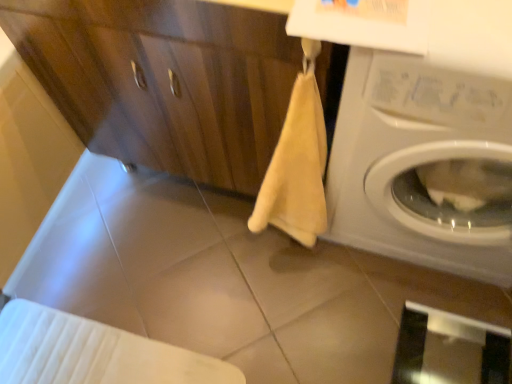
This screenshot has width=512, height=384. What do you see at coordinates (164, 80) in the screenshot?
I see `matte wood dresser at center` at bounding box center [164, 80].

Find the location of `beige matte tile at center`. beige matte tile at center is located at coordinates 202,304.

Where is `transparent glass screen door at lower right`? transparent glass screen door at lower right is located at coordinates (450, 349).

What is the approximate width of white glossy washing machine at right?

white glossy washing machine at right is 40.90 centimeters wide.

Locate an element on the screen. Image resolution: width=512 pixels, height=384 pixels. matte wood dresser at center is located at coordinates (164, 80).

Considering the sizes of objects matte wood dresser at center and beige matte tile at center in the image provided, who is thinner, matte wood dresser at center or beige matte tile at center?

Thinner between the two is beige matte tile at center.

Locate an element on the screen. The height and width of the screenshot is (384, 512). dresser positioned vertically above the beige matte tile at center (from a real-world perspective) is located at coordinates (164, 80).

Can you confirm if matte wood dresser at center is bigger than beige matte tile at center?

Yes, matte wood dresser at center is bigger than beige matte tile at center.

Is the surface of matte wood dresser at center in direct contact with beige matte tile at center?

No, matte wood dresser at center is not next to beige matte tile at center.

Based on the photo, is beige matte tile at center at the right side of matte wood dresser at center?

In fact, beige matte tile at center is to the left of matte wood dresser at center.

In the image, is beige matte tile at center positioned in front of or behind matte wood dresser at center?

In the image, beige matte tile at center appears behind matte wood dresser at center.

Is beige matte tile at center not close to matte wood dresser at center?

That's not correct — beige matte tile at center is a little close to matte wood dresser at center.

From the image's perspective, relative to matte wood dresser at center, is beige matte tile at center above or below?

beige matte tile at center is situated lower than matte wood dresser at center in the image.

Consider the image. Which object is positioned more to the right, white glossy washing machine at right or transparent glass screen door at lower right?

Positioned to the right is transparent glass screen door at lower right.

From a real-world perspective, between white glossy washing machine at right and transparent glass screen door at lower right, who is vertically lower?

transparent glass screen door at lower right is physically lower.

Based on the photo, are white glossy washing machine at right and transparent glass screen door at lower right far apart?

white glossy washing machine at right is actually quite close to transparent glass screen door at lower right.

Is transparent glass screen door at lower right situated inside matte wood dresser at center or outside?

transparent glass screen door at lower right is not enclosed by matte wood dresser at center.

Can you confirm if transparent glass screen door at lower right is taller than matte wood dresser at center?

Incorrect, the height of transparent glass screen door at lower right is not larger of that of matte wood dresser at center.

From the image's perspective, is transparent glass screen door at lower right on top of matte wood dresser at center?

No, from the image's perspective, transparent glass screen door at lower right is not over matte wood dresser at center.

How far apart are transparent glass screen door at lower right and matte wood dresser at center?

A distance of 86.95 centimeters exists between transparent glass screen door at lower right and matte wood dresser at center.

Is matte wood dresser at center shorter than transparent glass screen door at lower right?

Incorrect, the height of matte wood dresser at center does not fall short of that of transparent glass screen door at lower right.

What's the angular difference between matte wood dresser at center and transparent glass screen door at lower right's facing directions?

0.22 degrees separate the facing orientations of matte wood dresser at center and transparent glass screen door at lower right.

Are matte wood dresser at center and transparent glass screen door at lower right making contact?

No, matte wood dresser at center is not touching transparent glass screen door at lower right.

Does matte wood dresser at center have a larger size compared to transparent glass screen door at lower right?

Yes, matte wood dresser at center is bigger than transparent glass screen door at lower right.

Is transparent glass screen door at lower right far away from beige matte tile at center?

transparent glass screen door at lower right is actually quite close to beige matte tile at center.

At what (x,y) coordinates should I click in order to perform the action: click on screen door on the right of beige matte tile at center. Please return your answer as a coordinate pair (x, y). Looking at the image, I should click on (450, 349).

From the image's perspective, is transparent glass screen door at lower right positioned above or below beige matte tile at center?

Based on their image positions, transparent glass screen door at lower right is located beneath beige matte tile at center.

From a real-world perspective, which object rests below the other?

transparent glass screen door at lower right.

Considering the positions of objects matte wood dresser at center and white glossy washing machine at right in the image provided, who is behind, matte wood dresser at center or white glossy washing machine at right?

matte wood dresser at center is further from the camera.

From the image's perspective, is matte wood dresser at center over white glossy washing machine at right?

Yes, from the image's perspective, matte wood dresser at center is on top of white glossy washing machine at right.

Which object is positioned more to the right, matte wood dresser at center or white glossy washing machine at right?

Positioned to the right is white glossy washing machine at right.

Is matte wood dresser at center touching white glossy washing machine at right?

No, matte wood dresser at center is not with white glossy washing machine at right.

The width and height of the screenshot is (512, 384). I want to click on tile located behind the matte wood dresser at center, so click(202, 304).

Find the location of a particular element. Image resolution: width=512 pixels, height=384 pixels. tile located underneath the matte wood dresser at center (from a real-world perspective) is located at coordinates [202, 304].

Estimate the real-world distances between objects in this image. Which object is closer to matte wood dresser at center, white glossy washing machine at right or beige matte tile at center?

white glossy washing machine at right.

Considering their positions, is matte wood dresser at center positioned further to white glossy washing machine at right than transparent glass screen door at lower right?

transparent glass screen door at lower right.

From the image, which object appears to be nearer to matte wood dresser at center, beige matte tile at center or transparent glass screen door at lower right?

beige matte tile at center is positioned closer to the anchor matte wood dresser at center.

Which object lies nearer to the anchor point beige matte tile at center, transparent glass screen door at lower right or white glossy washing machine at right?

white glossy washing machine at right is closer to beige matte tile at center.

Looking at the image, which one is located closer to beige matte tile at center, matte wood dresser at center or white glossy washing machine at right?

The object closer to beige matte tile at center is matte wood dresser at center.

Considering their positions, is matte wood dresser at center positioned closer to transparent glass screen door at lower right than white glossy washing machine at right?

Based on the image, white glossy washing machine at right appears to be nearer to transparent glass screen door at lower right.

From the image, which object appears to be nearer to white glossy washing machine at right, matte wood dresser at center or beige matte tile at center?

matte wood dresser at center is closer to white glossy washing machine at right.

When comparing their distances from transparent glass screen door at lower right, does matte wood dresser at center or beige matte tile at center seem further?

Based on the image, matte wood dresser at center appears to be further to transparent glass screen door at lower right.

Find the location of a particular element. This screenshot has width=512, height=384. washing machine between matte wood dresser at center and transparent glass screen door at lower right from top to bottom is located at coordinates (417, 163).

This screenshot has height=384, width=512. I want to click on washing machine situated between beige matte tile at center and transparent glass screen door at lower right from left to right, so click(417, 163).

Where is `tile between matte wood dresser at center and transparent glass screen door at lower right vertically`? The width and height of the screenshot is (512, 384). tile between matte wood dresser at center and transparent glass screen door at lower right vertically is located at coordinates (202, 304).

Find the location of a particular element. Image resolution: width=512 pixels, height=384 pixels. dresser between beige matte tile at center and white glossy washing machine at right in the horizontal direction is located at coordinates (164, 80).